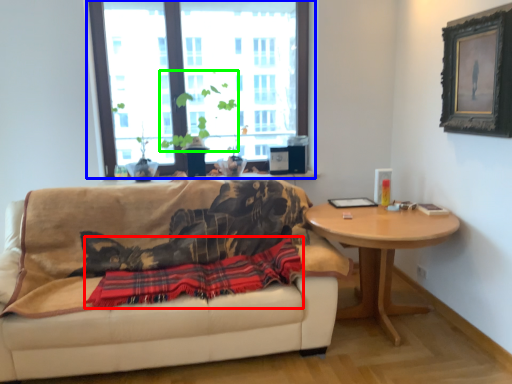
Question: Which object is the closest to the plaid (highlighted by a red box)? Choose among these: window (highlighted by a blue box) or plant (highlighted by a green box).

Choices:
 (A) window
 (B) plant

Answer: (B)